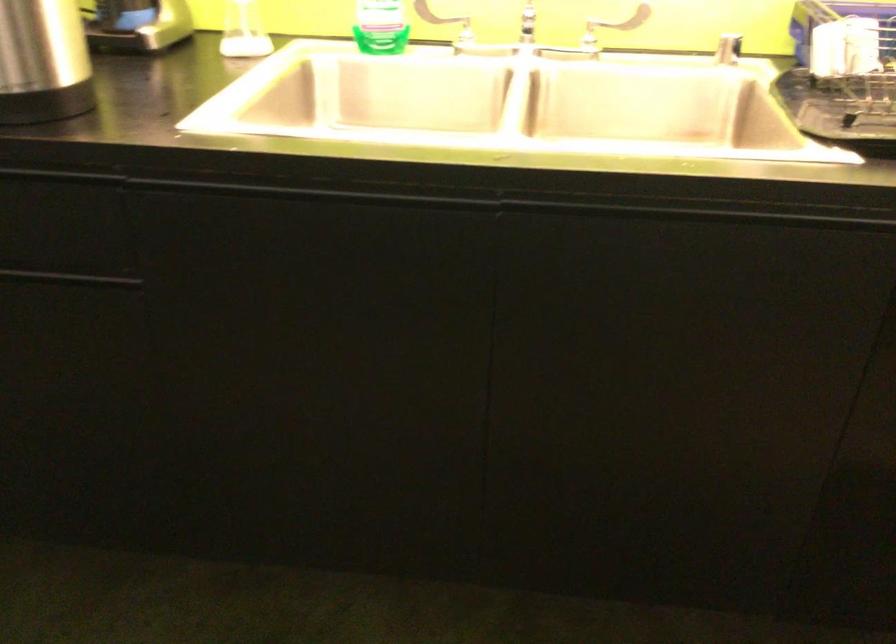
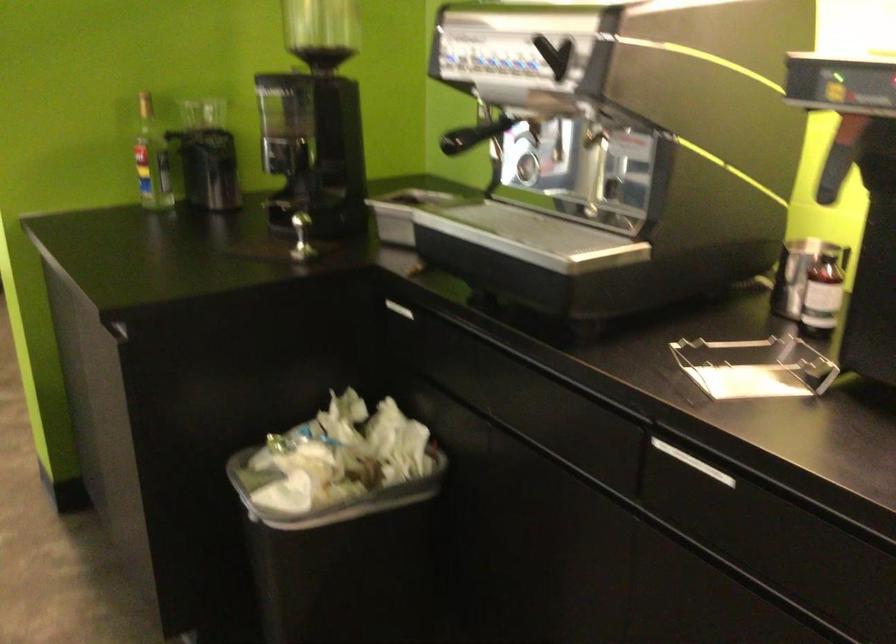
Question: Based on the continuous images, in which direction is the camera rotating? Reply with the corresponding letter.

Choices:
 (A) Left
 (B) Right
 (C) Up
 (D) Down

Answer: (A)